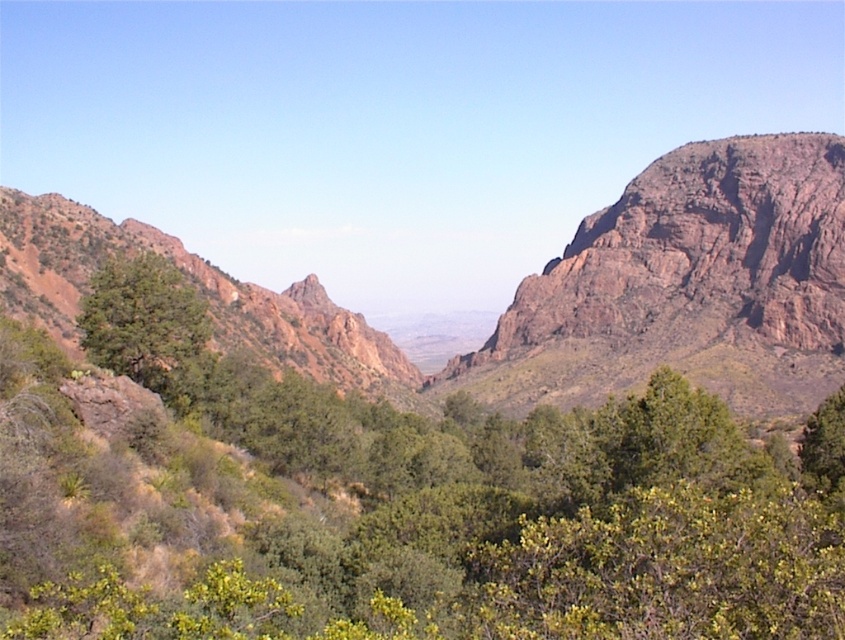
Question: Which of the following is the farthest from the observer?

Choices:
 (A) rustic rock formation at left
 (B) rusty rock mountain at right
 (C) green leafy tree at center
 (D) rustic rock mountain at center

Answer: (B)

Question: Considering the relative positions of rustic rock mountain at center and rusty rock mountain at right in the image provided, where is rustic rock mountain at center located with respect to rusty rock mountain at right?

Choices:
 (A) below
 (B) above

Answer: (A)

Question: In this image, where is rusty rock mountain at right located relative to green leafy tree at center?

Choices:
 (A) right
 (B) left

Answer: (A)

Question: Which object appears closest to the camera in this image?

Choices:
 (A) rustic rock mountain at center
 (B) green leafy tree at left

Answer: (B)

Question: Does rustic rock mountain at center have a greater width compared to rusty rock mountain at right?

Choices:
 (A) no
 (B) yes

Answer: (B)

Question: Which object appears farthest from the camera in this image?

Choices:
 (A) rusty rock mountain at right
 (B) rustic rock mountain at center
 (C) green leafy tree at left
 (D) rustic rock formation at left

Answer: (A)